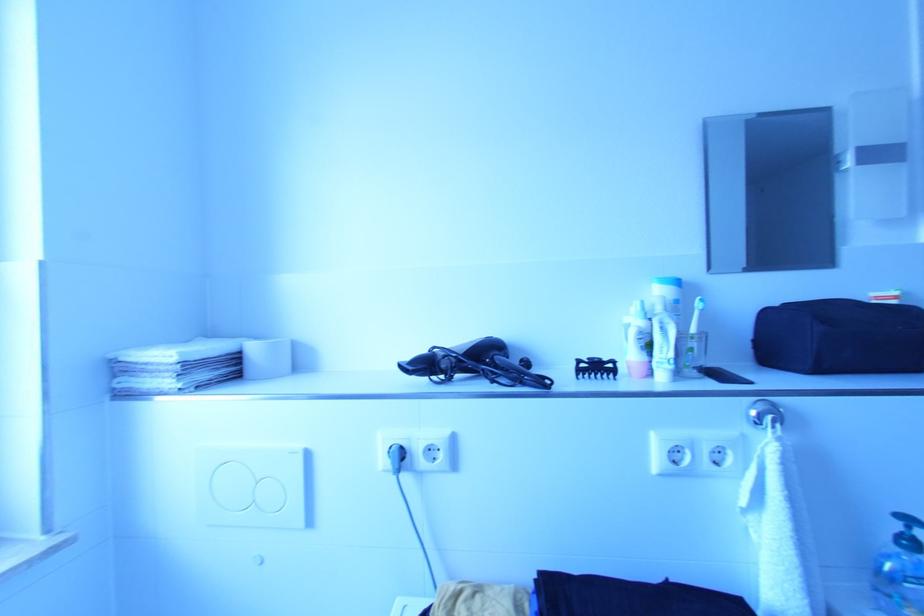
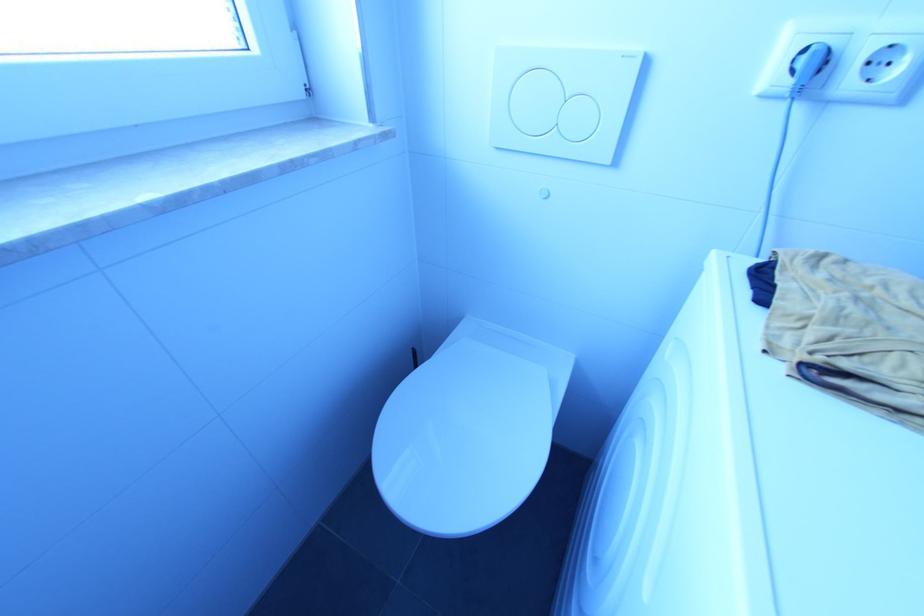
First-person continuous shooting, in which direction is the camera rotating?

The camera rotated toward left-down.